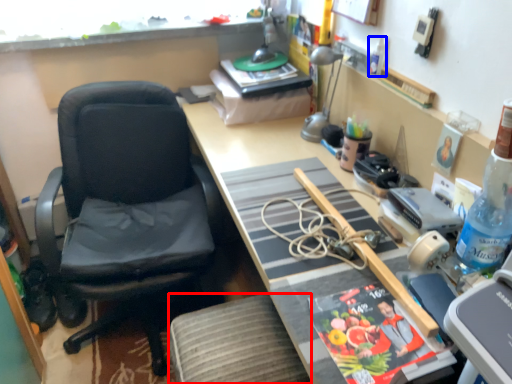
Question: Among these objects, which one is farthest to the camera, stool (highlighted by a red box) or bottle (highlighted by a blue box)?

Choices:
 (A) stool
 (B) bottle

Answer: (B)